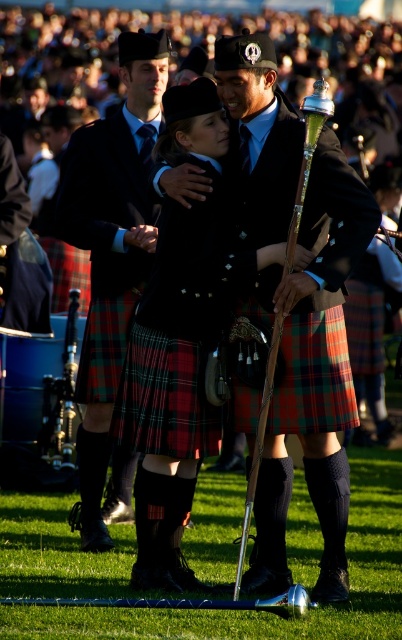
Question: Based on their relative distances, which object is farther from the red plaid kilt at center?

Choices:
 (A) matte black kilt at center
 (B) shiny black kilt at center

Answer: (A)

Question: Which of the following is the farthest from the observer?

Choices:
 (A) shiny black kilt at center
 (B) red plaid kilt at center

Answer: (A)

Question: Is the position of matte black kilt at center less distant than that of red plaid kilt at center?

Choices:
 (A) yes
 (B) no

Answer: (B)

Question: Among these objects, which one is farthest from the camera?

Choices:
 (A) matte black kilt at center
 (B) red plaid kilt at center

Answer: (A)

Question: Is shiny black kilt at center below matte black kilt at center?

Choices:
 (A) yes
 (B) no

Answer: (B)

Question: Is shiny black kilt at center positioned behind red plaid kilt at center?

Choices:
 (A) no
 (B) yes

Answer: (B)